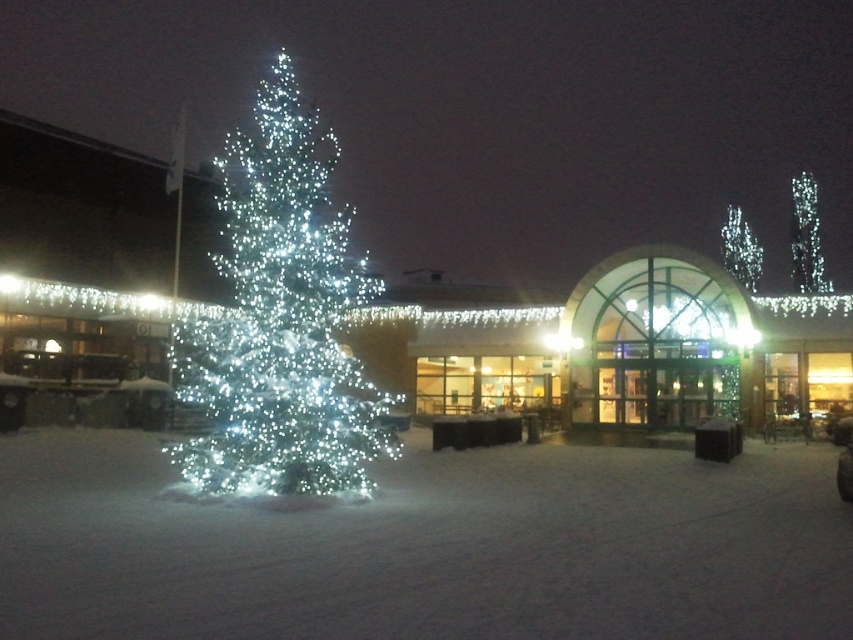
Is icy white lights at left to the left of icy white lights at center from the viewer's perspective?

Indeed, icy white lights at left is positioned on the left side of icy white lights at center.

Who is more forward, (352, 266) or (741, 278)?

Point (352, 266)

Find the location of a particular element. This screenshot has width=853, height=640. icy white lights at left is located at coordinates point(281,321).

You are a GUI agent. You are given a task and a screenshot of the screen. Output one action in this format:
    pyautogui.click(x=<x>, y=<y>)
    Task: Click on the icy white lights at left
    
    Given the screenshot: What is the action you would take?
    pyautogui.click(x=281, y=321)

Who is more forward, (305, 124) or (798, 256)?

Point (305, 124) is more forward.

Which is in front, point (363, 385) or point (802, 246)?

Point (363, 385)

Where is `icy white lights at left`? icy white lights at left is located at coordinates (281, 321).

Does icy white lights at upper right appear on the right side of icy white lights at center?

Correct, you'll find icy white lights at upper right to the right of icy white lights at center.

Is point (799, 284) positioned after point (728, 232)?

No, (799, 284) is in front of (728, 232).

This screenshot has width=853, height=640. I want to click on icy white lights at upper right, so click(x=805, y=237).